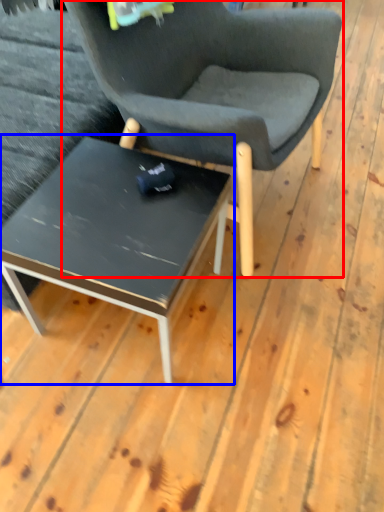
Question: Which object appears closest to the camera in this image, chair (highlighted by a red box) or coffee table (highlighted by a blue box)?

Choices:
 (A) chair
 (B) coffee table

Answer: (A)